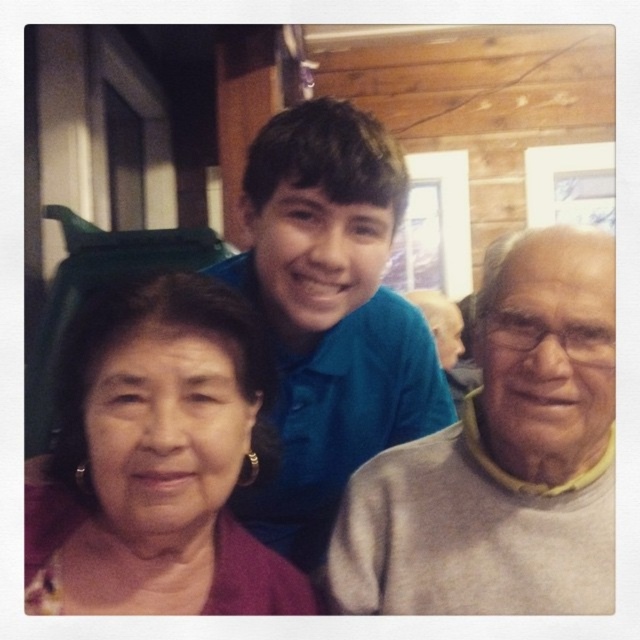
Between gray/yellow sweater at right and purple fabric at left, which one is positioned lower?

purple fabric at left is lower down.

From the picture: Between gray/yellow sweater at right and purple fabric at left, which one has less height?

purple fabric at left

Is point (387, 556) in front of point (237, 339)?

No, (387, 556) is further to viewer.

Where is `gray/yellow sweater at right`? Image resolution: width=640 pixels, height=640 pixels. gray/yellow sweater at right is located at coordinates (502, 458).

Which of these two, purple fabric at left or blue cotton shirt at center, stands shorter?

With less height is purple fabric at left.

Between point (160, 582) and point (301, 227), which one is positioned in front?

Point (160, 582) is more forward.

Which is in front, point (244, 554) or point (368, 394)?

Point (244, 554)

Find the location of `purple fabric at left`. purple fabric at left is located at coordinates pyautogui.click(x=157, y=460).

Describe the element at coordinates (502, 458) in the screenshot. I see `gray/yellow sweater at right` at that location.

Which is more to the left, gray/yellow sweater at right or blue cotton shirt at center?

From the viewer's perspective, blue cotton shirt at center appears more on the left side.

The image size is (640, 640). Identify the location of gray/yellow sweater at right. (502, 458).